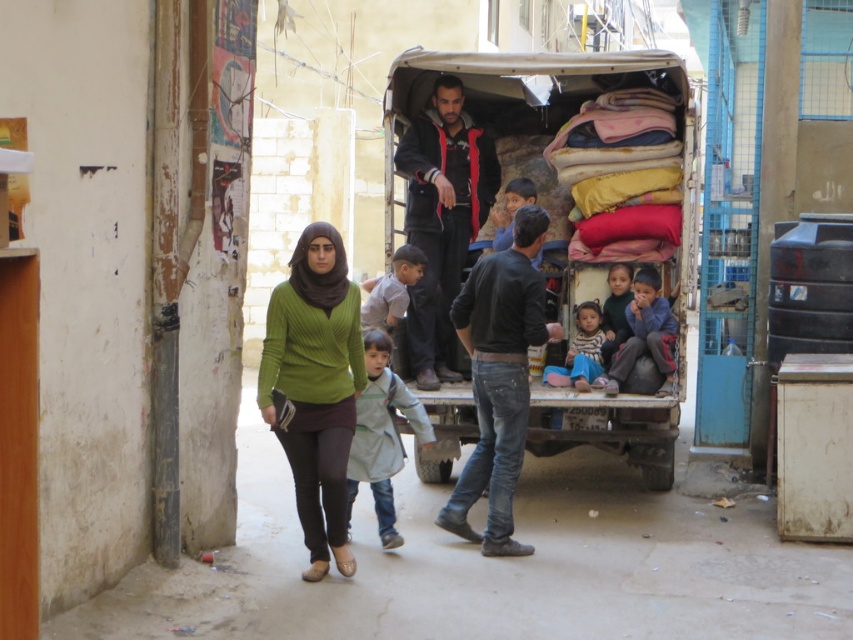
Does green ribbed sweater at center have a lesser height compared to light gray fabric jacket at center?

No.

Find the location of `green ribbed sweater at center`. green ribbed sweater at center is located at coordinates (315, 387).

Is green ribbed sweater at center thinner than light brown fabric pants at lower right?

Indeed, green ribbed sweater at center has a lesser width compared to light brown fabric pants at lower right.

Who is positioned more to the left, green ribbed sweater at center or light brown fabric pants at lower right?

green ribbed sweater at center

The height and width of the screenshot is (640, 853). What do you see at coordinates (315, 387) in the screenshot?
I see `green ribbed sweater at center` at bounding box center [315, 387].

Find the location of a particular element. The image size is (853, 640). green ribbed sweater at center is located at coordinates (315, 387).

Is textured fabric cart at center above green ribbed sweater at center?

Indeed, textured fabric cart at center is positioned over green ribbed sweater at center.

Who is more distant from viewer, (457, 397) or (350, 429)?

The point (457, 397) is behind.

This screenshot has width=853, height=640. What do you see at coordinates (567, 150) in the screenshot?
I see `textured fabric cart at center` at bounding box center [567, 150].

Find the location of a particular element. textured fabric cart at center is located at coordinates (567, 150).